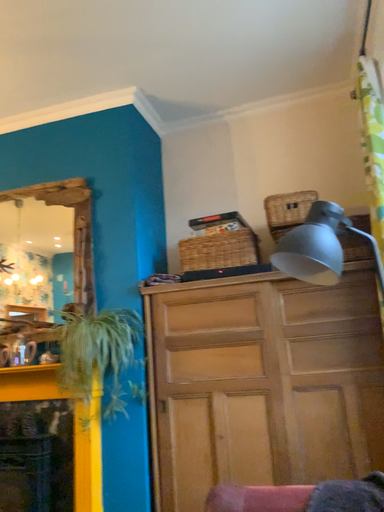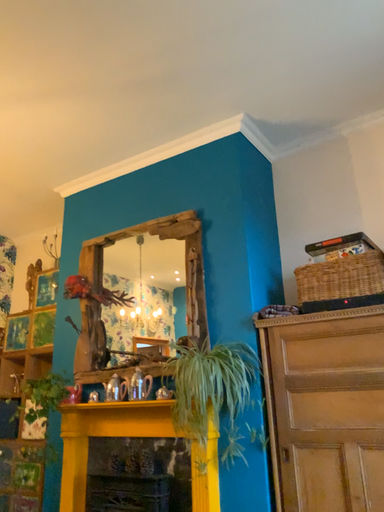
Question: How did the camera likely rotate when shooting the video?

Choices:
 (A) rotated left
 (B) rotated right

Answer: (A)